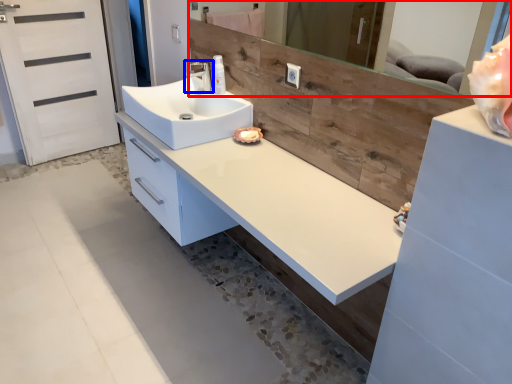
Question: Which point is further to the camera, mirror (highlighted by a red box) or tap (highlighted by a blue box)?

Choices:
 (A) mirror
 (B) tap

Answer: (B)